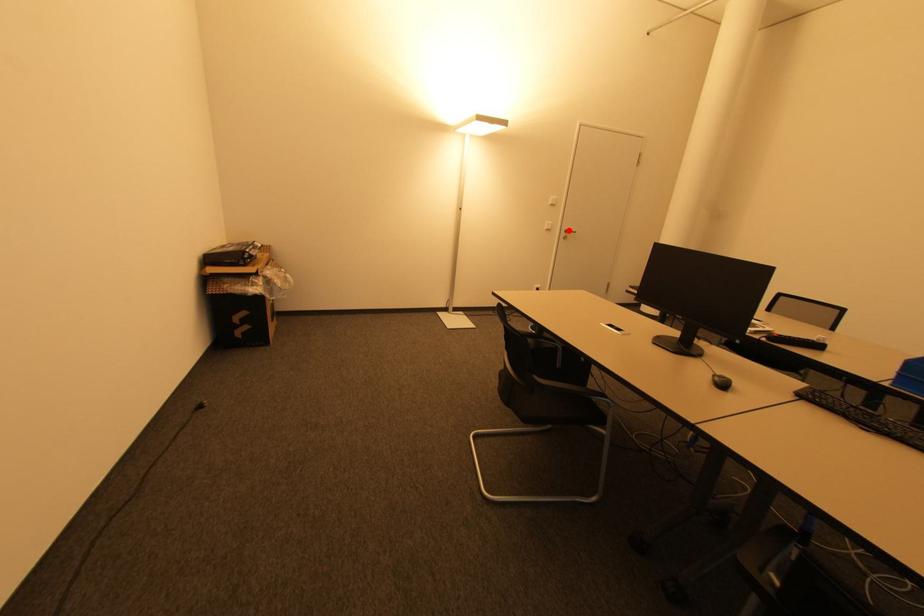
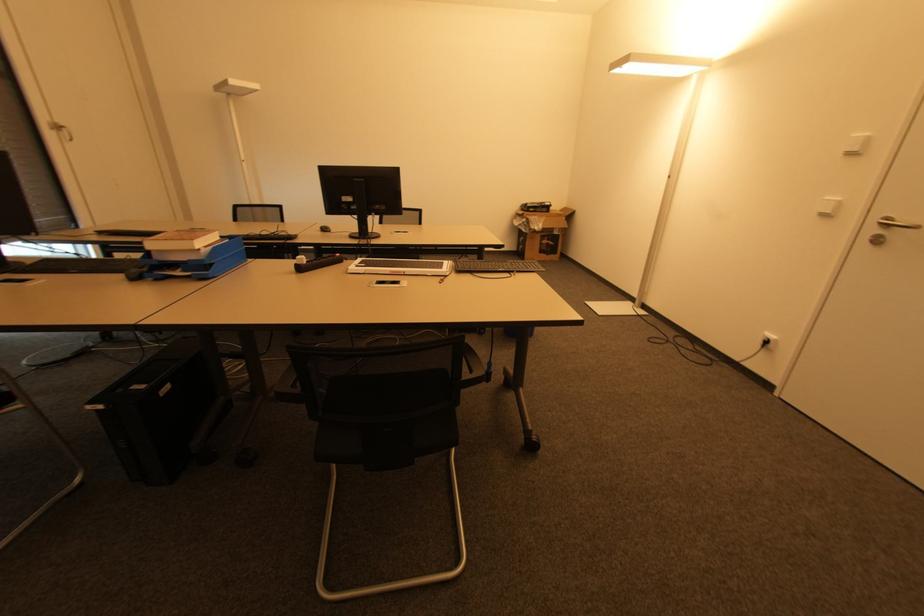
The point at the highlighted location is marked in the first image. Where is the corresponding point in the second image?

(890, 221)